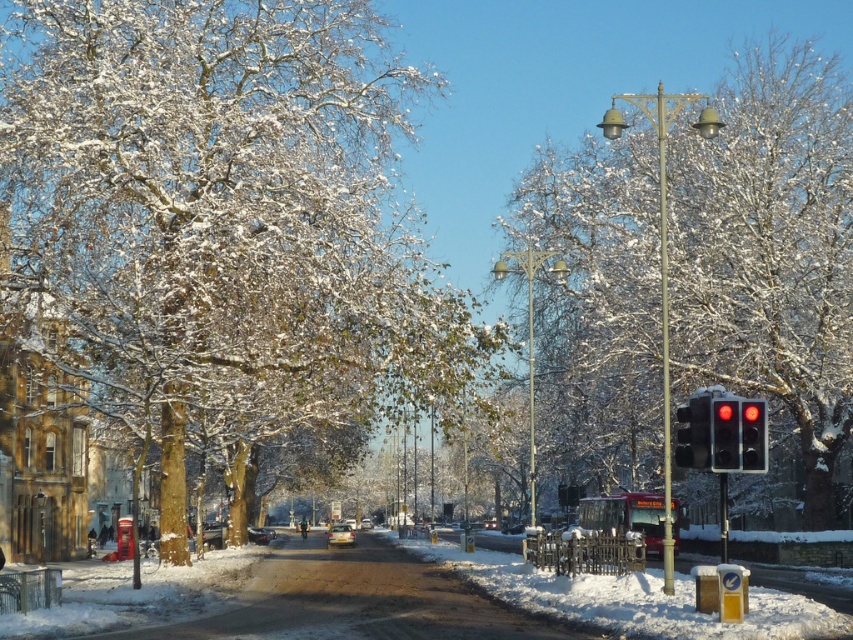
Question: Can you confirm if red glass traffic light at right is thinner than matte silver car at center?

Choices:
 (A) yes
 (B) no

Answer: (A)

Question: Which object appears closest to the camera in this image?

Choices:
 (A) red glass traffic light at right
 (B) metallic red traffic light at right
 (C) snow-covered tree at right
 (D) snow-covered tree at center

Answer: (A)

Question: Is black plastic traffic light at right in front of red glass traffic light at right?

Choices:
 (A) yes
 (B) no

Answer: (B)

Question: Among these objects, which one is nearest to the camera?

Choices:
 (A) black plastic traffic light at right
 (B) shiny silver car at center
 (C) snow-covered tree at center

Answer: (A)

Question: Which point is closer to the camera?

Choices:
 (A) (764, 426)
 (B) (735, 451)

Answer: (B)

Question: Does snow-covered tree at center have a smaller size compared to shiny silver car at center?

Choices:
 (A) yes
 (B) no

Answer: (B)